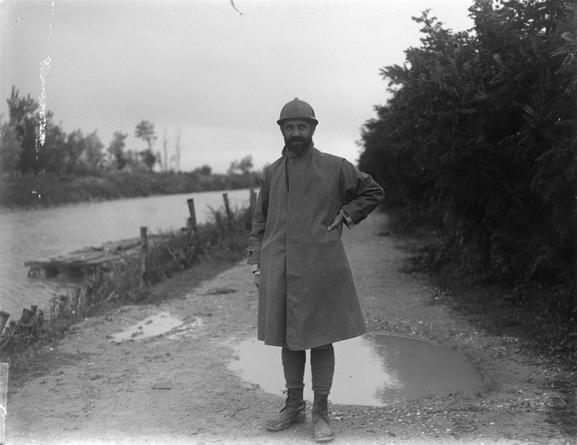
Identify the location of coat. The width and height of the screenshot is (577, 445). (314, 248).